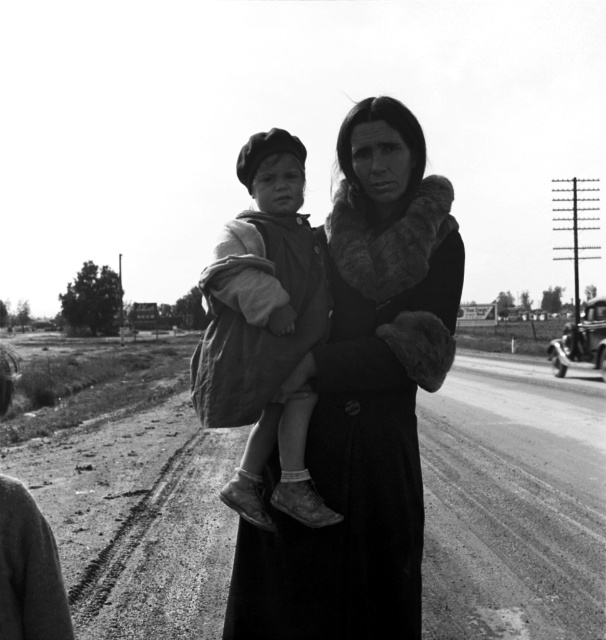
You are a photographer trying to capture a wide shot of the dirt track at center and the dark fur coat at center. Which object should you focus on first if you want to include both in your frame without zooming in?

The dirt track at center is bigger than the dark fur coat at center, so you should focus on the dirt track at center first to ensure it fits properly in the frame before adjusting for the smaller dark fur coat at center.

You are a photographer trying to capture the dark fur coat at center in this black and white photo. The camera you are using has a focus point at coordinate point (364,400). Will this focus point be effective for capturing the dark fur coat at center?

The point (364,400) indicates dark fur coat at center, so yes, the focus point at coordinate point (364,400) will effectively capture the dark fur coat at center.